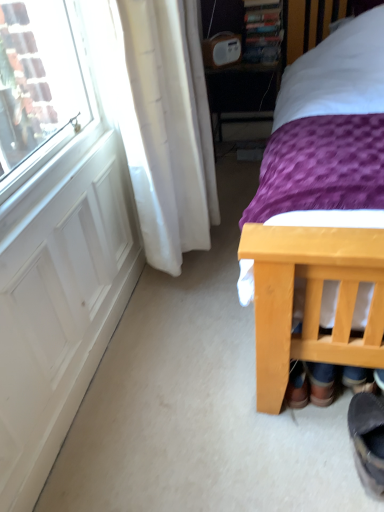
Question: In terms of height, does dark grey suede boot at lower right look taller or shorter compared to white matte screen door at left?

Choices:
 (A) short
 (B) tall

Answer: (A)

Question: From the image's perspective, is dark grey suede boot at lower right above or below white matte screen door at left?

Choices:
 (A) below
 (B) above

Answer: (A)

Question: Which of these objects is positioned farthest from the purple fabric bed at right?

Choices:
 (A) wooden table at center
 (B) dark grey suede boot at lower right
 (C) white matte screen door at left

Answer: (A)

Question: Based on their relative distances, which object is nearer to the dark grey suede boot at lower right?

Choices:
 (A) wooden table at center
 (B) purple fabric bed at right
 (C) white matte screen door at left

Answer: (B)